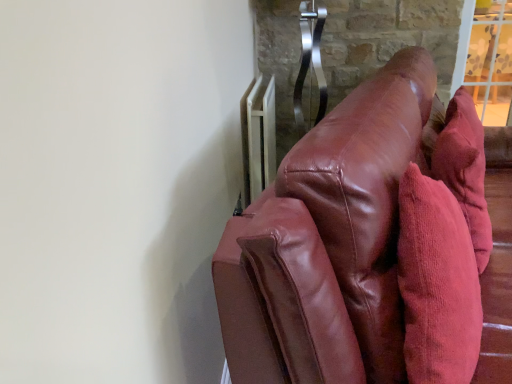
Where is `corduroy throw pillow at right`? The height and width of the screenshot is (384, 512). corduroy throw pillow at right is located at coordinates (465, 170).

Locate an element on the screen. shiny brown leather couch at right is located at coordinates (340, 239).

Which of these two, corduroy throw pillow at right or shiny brown leather couch at right, stands taller?

shiny brown leather couch at right.

Measure the distance from corduroy throw pillow at right to shiny brown leather couch at right.

The distance of corduroy throw pillow at right from shiny brown leather couch at right is 13.42 inches.

From a real-world perspective, is corduroy throw pillow at right positioned above or below shiny brown leather couch at right?

corduroy throw pillow at right is above shiny brown leather couch at right.

Between corduroy throw pillow at right and shiny brown leather couch at right, which one has smaller width?

corduroy throw pillow at right is thinner.

Which is behind, shiny brown leather couch at right or corduroy throw pillow at right?

corduroy throw pillow at right is more distant.

Does point (384, 163) come closer to viewer compared to point (457, 193)?

That is True.

You are a GUI agent. You are given a task and a screenshot of the screen. Output one action in this format:
    pyautogui.click(x=<x>, y=<y>)
    Task: Click on the furniture that is in front of the corduroy throw pillow at right
    
    Given the screenshot: What is the action you would take?
    pyautogui.click(x=340, y=239)

In terms of width, does shiny brown leather couch at right look wider or thinner when compared to corduroy throw pillow at right?

shiny brown leather couch at right is wider than corduroy throw pillow at right.

From the image's perspective, who appears lower, shiny brown leather couch at right or white metallic radiator at upper right?

shiny brown leather couch at right.

Is shiny brown leather couch at right turned away from white metallic radiator at upper right?

Absolutely, shiny brown leather couch at right is directed away from white metallic radiator at upper right.

Is shiny brown leather couch at right far from white metallic radiator at upper right?

shiny brown leather couch at right is actually quite close to white metallic radiator at upper right.

From a real-world perspective, which object stands above the other?

white metallic radiator at upper right, from a real-world perspective.

Considering the relative sizes of corduroy throw pillow at right and white metallic radiator at upper right in the image provided, is corduroy throw pillow at right bigger than white metallic radiator at upper right?

Yes.

From the image's perspective, relative to white metallic radiator at upper right, is corduroy throw pillow at right above or below?

corduroy throw pillow at right is below white metallic radiator at upper right.

Consider the image. Can you confirm if corduroy throw pillow at right is shorter than white metallic radiator at upper right?

No.

Which is closer to the camera, (247, 190) or (480, 183)?

Point (247, 190) is farther from the camera than point (480, 183).

Is white metallic radiator at upper right further to camera compared to corduroy throw pillow at right?

That is True.

From the image's perspective, between white metallic radiator at upper right and corduroy throw pillow at right, which one is located above?

white metallic radiator at upper right.

Considering their positions, is white metallic radiator at upper right located in front of or behind shiny brown leather couch at right?

Clearly, white metallic radiator at upper right is behind shiny brown leather couch at right.

Who is bigger, white metallic radiator at upper right or shiny brown leather couch at right?

shiny brown leather couch at right.

Based on the photo, from a real-world perspective, which is physically below, white metallic radiator at upper right or shiny brown leather couch at right?

From a 3D spatial view, shiny brown leather couch at right is below.

Who is shorter, white metallic radiator at upper right or shiny brown leather couch at right?

With less height is white metallic radiator at upper right.

Locate an element on the screen. The width and height of the screenshot is (512, 384). throw pillow above the shiny brown leather couch at right (from the image's perspective) is located at coordinates (465, 170).

Image resolution: width=512 pixels, height=384 pixels. In order to click on furniture that is on the left side of corduroy throw pillow at right in this screenshot , I will do `click(340, 239)`.

When comparing their distances from corduroy throw pillow at right, does shiny brown leather couch at right or white metallic radiator at upper right seem further?

white metallic radiator at upper right is further to corduroy throw pillow at right.

When comparing their distances from corduroy throw pillow at right, does white metallic radiator at upper right or shiny brown leather couch at right seem further?

white metallic radiator at upper right.

Based on their spatial positions, is corduroy throw pillow at right or white metallic radiator at upper right further from shiny brown leather couch at right?

white metallic radiator at upper right lies further to shiny brown leather couch at right than the other object.

Looking at the image, which one is located further to white metallic radiator at upper right, corduroy throw pillow at right or shiny brown leather couch at right?

shiny brown leather couch at right.

Based on the photo, based on their spatial positions, is white metallic radiator at upper right or corduroy throw pillow at right closer to shiny brown leather couch at right?

corduroy throw pillow at right.

Estimate the real-world distances between objects in this image. Which object is closer to white metallic radiator at upper right, shiny brown leather couch at right or corduroy throw pillow at right?

The object closer to white metallic radiator at upper right is corduroy throw pillow at right.

You are a GUI agent. You are given a task and a screenshot of the screen. Output one action in this format:
    pyautogui.click(x=<x>, y=<y>)
    Task: Click on the throw pillow positioned between shiny brown leather couch at right and white metallic radiator at upper right from near to far
    Image resolution: width=512 pixels, height=384 pixels.
    Given the screenshot: What is the action you would take?
    pyautogui.click(x=465, y=170)